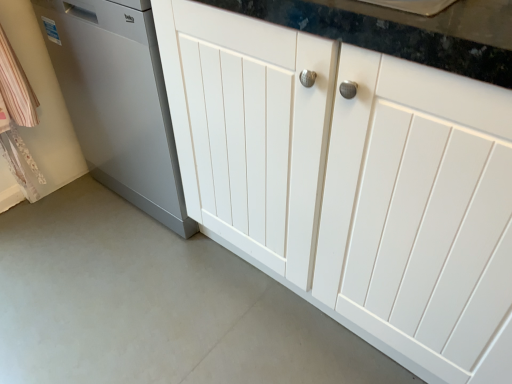
Question: From a real-world perspective, is satin silver dishwasher at left under white smooth concrete at lower center?

Choices:
 (A) yes
 (B) no

Answer: (B)

Question: Considering the relative sizes of satin silver dishwasher at left and white smooth concrete at lower center in the image provided, is satin silver dishwasher at left smaller than white smooth concrete at lower center?

Choices:
 (A) no
 (B) yes

Answer: (A)

Question: Does satin silver dishwasher at left have a greater width compared to white smooth concrete at lower center?

Choices:
 (A) no
 (B) yes

Answer: (A)

Question: Can you confirm if satin silver dishwasher at left is positioned to the left of white smooth concrete at lower center?

Choices:
 (A) yes
 (B) no

Answer: (B)

Question: Can you confirm if satin silver dishwasher at left is bigger than white smooth concrete at lower center?

Choices:
 (A) no
 (B) yes

Answer: (B)

Question: Based on their positions, is white smooth concrete at lower center located to the left or right of white wood cabinet at center?

Choices:
 (A) left
 (B) right

Answer: (A)

Question: Is white smooth concrete at lower center spatially inside white wood cabinet at center, or outside of it?

Choices:
 (A) inside
 (B) outside

Answer: (B)

Question: From a real-world perspective, is white smooth concrete at lower center positioned above or below white wood cabinet at center?

Choices:
 (A) above
 (B) below

Answer: (B)

Question: Is white smooth concrete at lower center in front of or behind white wood cabinet at center in the image?

Choices:
 (A) behind
 (B) front

Answer: (A)

Question: Looking at the image, does satin silver dishwasher at left seem bigger or smaller compared to white wood cabinet at center?

Choices:
 (A) small
 (B) big

Answer: (A)

Question: Visually, is satin silver dishwasher at left positioned to the left or to the right of white wood cabinet at center?

Choices:
 (A) left
 (B) right

Answer: (A)

Question: Choose the correct answer: Is satin silver dishwasher at left inside white wood cabinet at center or outside it?

Choices:
 (A) outside
 (B) inside

Answer: (A)

Question: From a real-world perspective, relative to white wood cabinet at center, is satin silver dishwasher at left vertically above or below?

Choices:
 (A) above
 (B) below

Answer: (B)

Question: Is satin silver dishwasher at left taller or shorter than white smooth concrete at lower center?

Choices:
 (A) short
 (B) tall

Answer: (B)

Question: From a real-world perspective, is satin silver dishwasher at left positioned above or below white smooth concrete at lower center?

Choices:
 (A) above
 (B) below

Answer: (A)